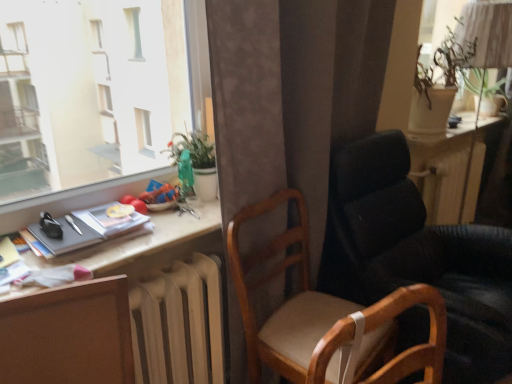
Question: Would you say matte black table lamp at upper right is part of matte white window sill at lower left's contents?

Choices:
 (A) no
 (B) yes

Answer: (A)

Question: Is there a large distance between matte white window sill at lower left and matte black table lamp at upper right?

Choices:
 (A) yes
 (B) no

Answer: (A)

Question: Is matte white window sill at lower left facing towards matte black table lamp at upper right?

Choices:
 (A) no
 (B) yes

Answer: (A)

Question: Can you confirm if matte white window sill at lower left is smaller than matte black table lamp at upper right?

Choices:
 (A) yes
 (B) no

Answer: (A)

Question: Can you confirm if matte white window sill at lower left is taller than matte black table lamp at upper right?

Choices:
 (A) yes
 (B) no

Answer: (B)

Question: Considering the relative sizes of matte white window sill at lower left and matte black table lamp at upper right in the image provided, is matte white window sill at lower left shorter than matte black table lamp at upper right?

Choices:
 (A) yes
 (B) no

Answer: (A)

Question: Considering the relative sizes of matte black book at left and beige fabric swivel chair at center in the image provided, is matte black book at left taller than beige fabric swivel chair at center?

Choices:
 (A) no
 (B) yes

Answer: (A)

Question: Is matte black book at left positioned with its back to beige fabric swivel chair at center?

Choices:
 (A) no
 (B) yes

Answer: (A)

Question: From the image's perspective, is matte black book at left located above beige fabric swivel chair at center?

Choices:
 (A) no
 (B) yes

Answer: (B)

Question: From a real-world perspective, is matte black book at left located beneath beige fabric swivel chair at center?

Choices:
 (A) no
 (B) yes

Answer: (A)

Question: Is matte black book at left behind beige fabric swivel chair at center?

Choices:
 (A) yes
 (B) no

Answer: (A)

Question: Is matte black book at left bigger than beige fabric swivel chair at center?

Choices:
 (A) no
 (B) yes

Answer: (A)

Question: Can you confirm if white matte radiator at lower center is positioned to the left of leather-like black chair at right, arranged as the 2th chair when viewed from the left?

Choices:
 (A) yes
 (B) no

Answer: (A)